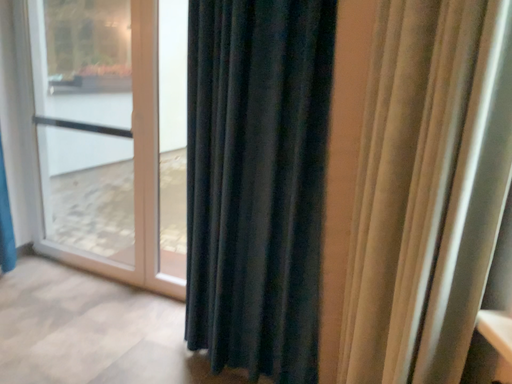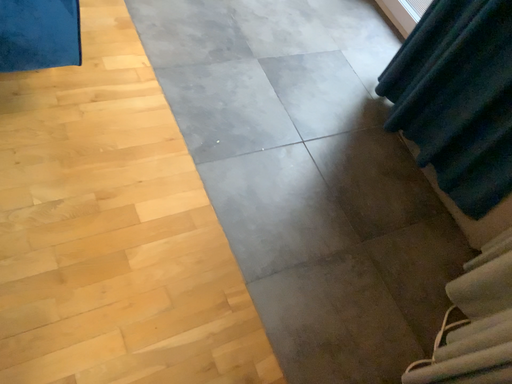
Question: Which way did the camera rotate in the video?

Choices:
 (A) rotated downward
 (B) rotated upward

Answer: (A)